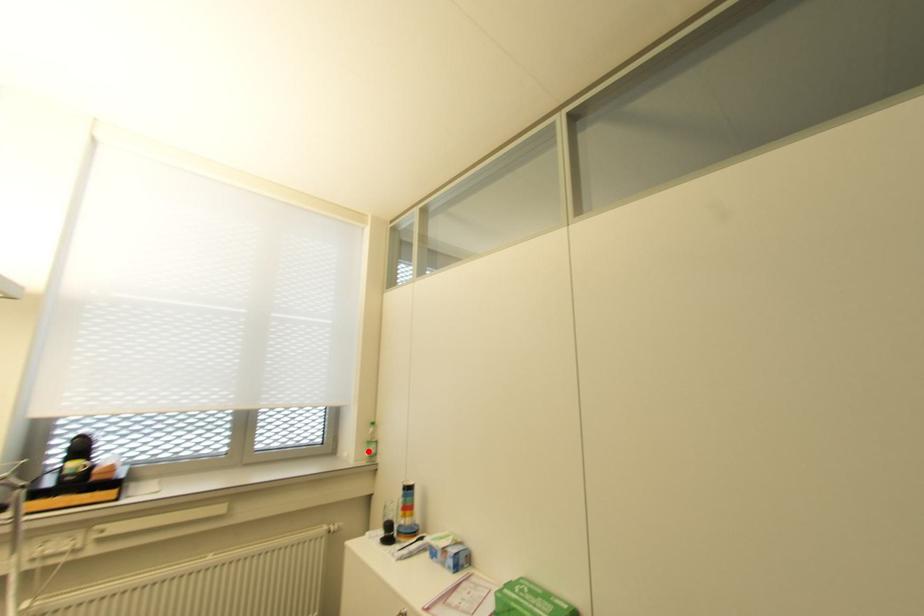
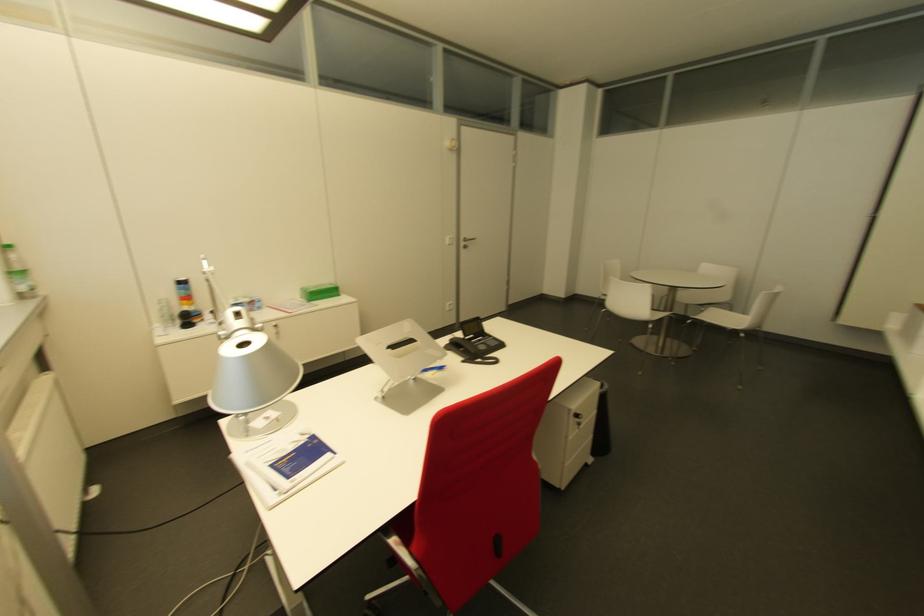
Question: I am providing you with two images of the same scene from different viewpoints. Image1 has a red point marked. In image2, the corresponding 3D location appears at what relative position? Reply with the corresponding letter.

Choices:
 (A) Closer
 (B) Farther

Answer: (B)